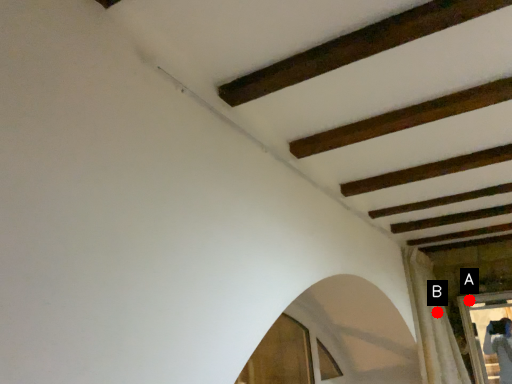
Question: Two points are circled on the image, labeled by A and B beside each circle. Which point is further to the camera?

Choices:
 (A) A is further
 (B) B is further

Answer: (A)